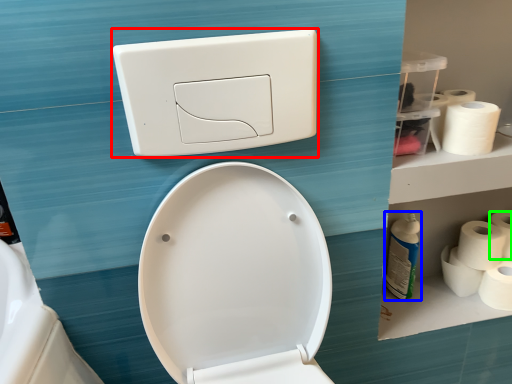
Question: Considering the real-world distances, which object is closest to light switch (highlighted by a red box)? cleaning product (highlighted by a blue box) or toilet paper (highlighted by a green box).

Choices:
 (A) cleaning product
 (B) toilet paper

Answer: (A)